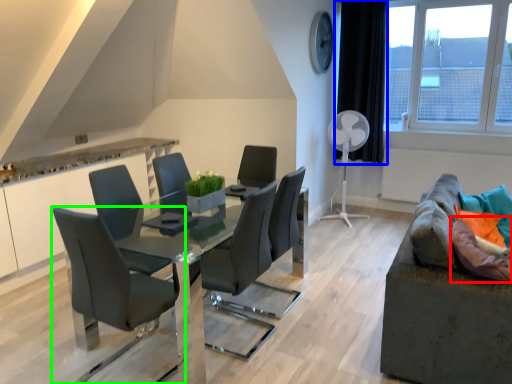
Question: Considering the real-world distances, which object is farthest from pillow (highlighted by a red box)? curtain (highlighted by a blue box) or chair (highlighted by a green box)?

Choices:
 (A) curtain
 (B) chair

Answer: (A)